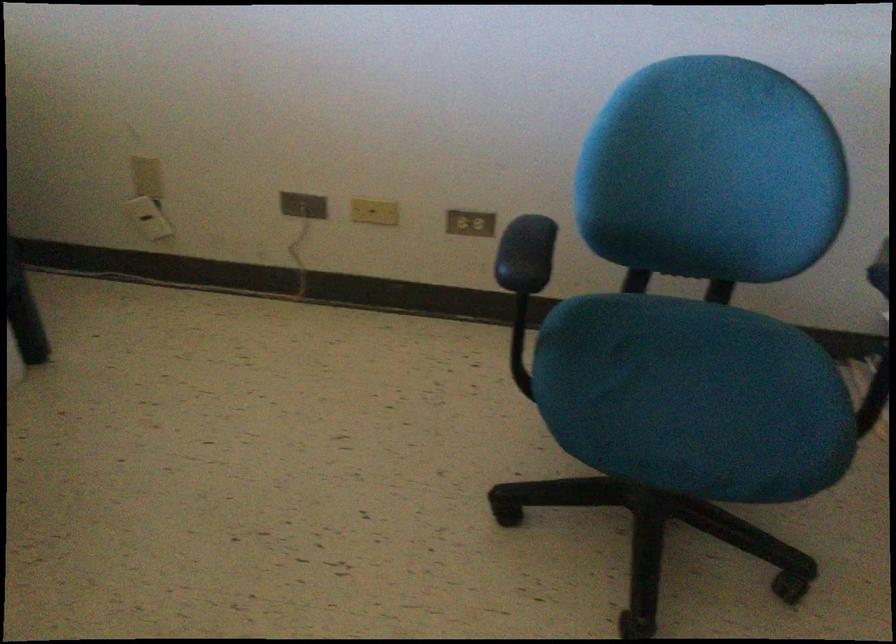
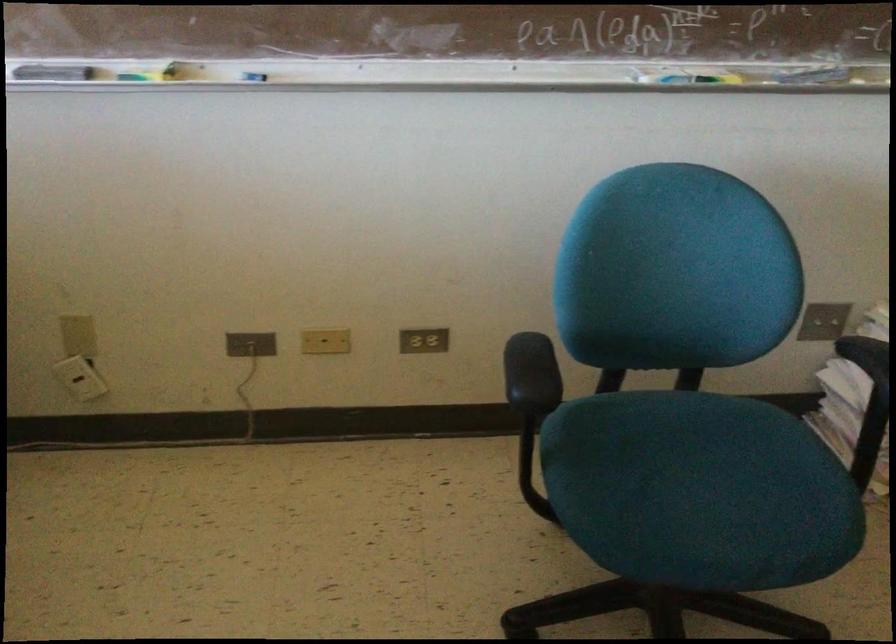
Find the pixel in the second image that matches [300,207] in the first image.

(250, 344)